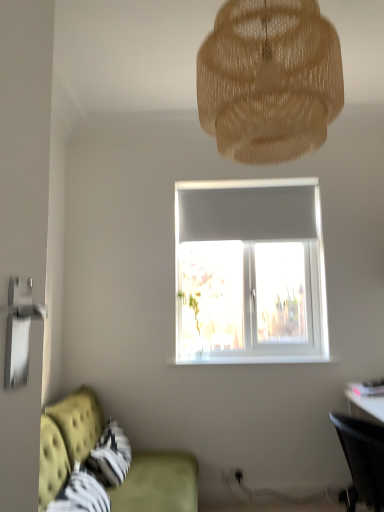
Question: Is black mesh chair at lower right wider or thinner than translucent beige mesh at upper center?

Choices:
 (A) wide
 (B) thin

Answer: (B)

Question: Is black mesh chair at lower right taller or shorter than translucent beige mesh at upper center?

Choices:
 (A) short
 (B) tall

Answer: (A)

Question: Which of these objects is positioned closest to the translucent beige mesh at upper center?

Choices:
 (A) velvet green couch at lower left
 (B) black mesh chair at lower right

Answer: (B)

Question: Which object is the closest to the velvet green couch at lower left?

Choices:
 (A) translucent beige mesh at upper center
 (B) black mesh chair at lower right

Answer: (B)